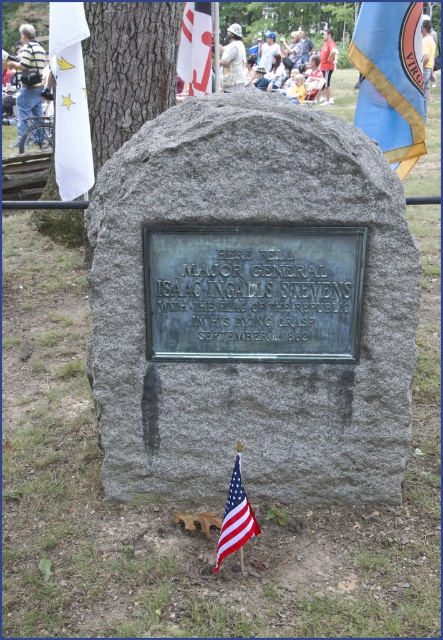
Question: Estimate the real-world distances between objects in this image. Which object is closer to the american flag at lower center?

Choices:
 (A) bronze plaque at center
 (B) smooth brown tree trunk at center

Answer: (A)

Question: Is smooth brown tree trunk at center smaller than blue fabric flag at upper right?

Choices:
 (A) yes
 (B) no

Answer: (B)

Question: Is american flag at lower center above brown wood tree at upper left?

Choices:
 (A) yes
 (B) no

Answer: (B)

Question: Which point is closer to the camera taking this photo?

Choices:
 (A) (174, 97)
 (B) (381, 70)
 (C) (298, 13)

Answer: (B)

Question: Does smooth gray tree trunk at center have a lesser width compared to american flag at lower center?

Choices:
 (A) yes
 (B) no

Answer: (B)

Question: Considering the real-world distances, which object is farthest from the smooth brown tree trunk at center?

Choices:
 (A) gray stone plaque at center
 (B) smooth gray tree trunk at center
 (C) blue fabric flag at upper right

Answer: (B)